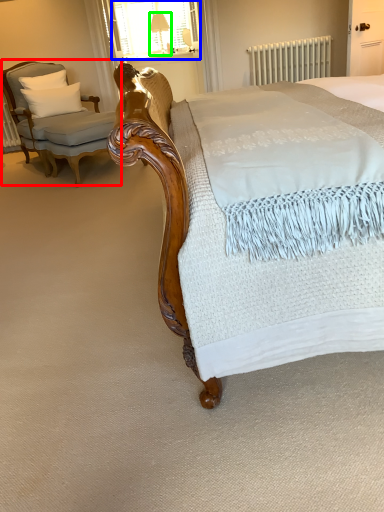
Question: Considering the real-world distances, which object is closest to chair (highlighted by a red box)? window screen (highlighted by a blue box) or table lamp (highlighted by a green box).

Choices:
 (A) window screen
 (B) table lamp

Answer: (A)